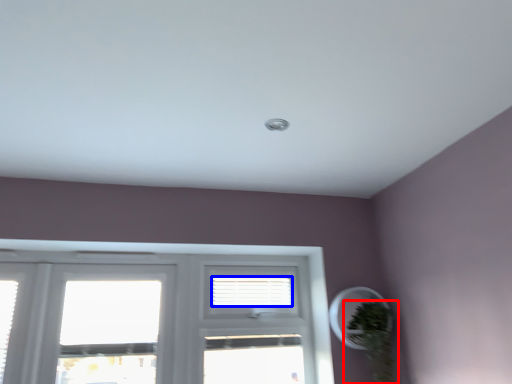
Question: Which of the following is the closest to the observer, houseplant (highlighted by a red box) or blind (highlighted by a blue box)?

Choices:
 (A) houseplant
 (B) blind

Answer: (A)